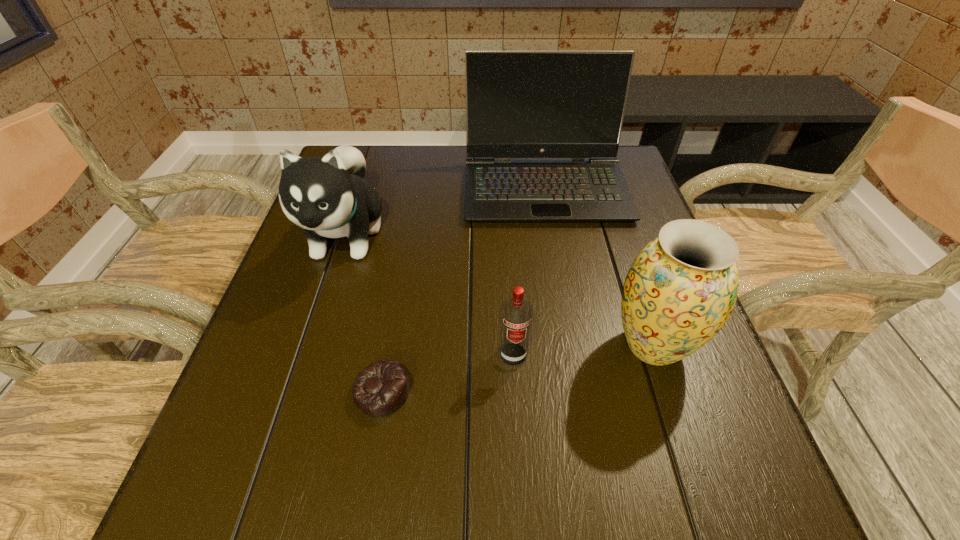
I want to click on free space between the beanbag and the laptop computer, so click(464, 289).

This screenshot has width=960, height=540. Identify the location of free space between the puppy and the laptop computer. (445, 211).

Where is `unoccupied area between the leftmost object and the laptop computer`? unoccupied area between the leftmost object and the laptop computer is located at coordinates (445, 211).

Find the location of a particular element. empty location between the fourth object from right to left and the fourth tallest object is located at coordinates (447, 373).

Locate an element on the screen. The image size is (960, 540). empty location between the laptop computer and the puppy is located at coordinates 445,211.

The image size is (960, 540). In order to click on blank region between the puppy and the beanbag in this screenshot , I will do `click(365, 313)`.

What are the coordinates of `free space that is in between the laptop computer and the second shortest object` in the screenshot? It's located at (529, 271).

Find the location of a particular element. The width and height of the screenshot is (960, 540). free point between the second object from left to right and the laptop computer is located at coordinates (464, 289).

Locate an element on the screen. free space that is in between the fourth tallest object and the fourth object from right to left is located at coordinates (447, 373).

This screenshot has height=540, width=960. Identify the location of vacant area between the leftmost object and the laptop computer. (445, 211).